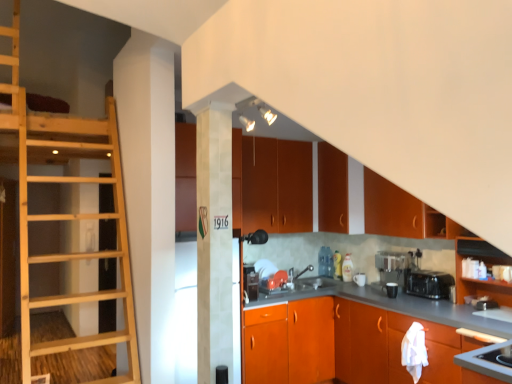
The width and height of the screenshot is (512, 384). Find the location of `matte wood cabinet at upper center, positioned as the 2th cabinetry in top-to-bottom order`. matte wood cabinet at upper center, positioned as the 2th cabinetry in top-to-bottom order is located at coordinates (339, 191).

You are a GUI agent. You are given a task and a screenshot of the screen. Output one action in this format:
    pyautogui.click(x=<x>, y=<y>)
    Task: Click on the metallic silver toaster at lower right, positioned as the first appliance in front-to-back order
    The image size is (512, 384).
    Given the screenshot: What is the action you would take?
    pyautogui.click(x=481, y=302)

You are a GUI agent. You are given a task and a screenshot of the screen. Output one action in this format:
    pyautogui.click(x=<x>, y=<y>)
    Task: Click on the matte wood cabinets at center, marked as the fourth cabinetry in a bottom-to-top arrangement
    This screenshot has width=512, height=384.
    Given the screenshot: What is the action you would take?
    pyautogui.click(x=277, y=186)

At what (x,y) coordinates should I click in order to perform the action: click on metallic silver coffee machine at lower right. Please return your answer as a coordinate pair (x, y). This screenshot has width=512, height=384. Looking at the image, I should click on (393, 267).

Image resolution: width=512 pixels, height=384 pixels. Identify the location of matte wood cabinet at upper center, positioned as the 2th cabinetry in top-to-bottom order. (339, 191).

Is orange matte cabinet at center, the 1th cabinetry ordered from the bottom, at the right side of natural wood ladder at left?

Yes, orange matte cabinet at center, the 1th cabinetry ordered from the bottom, is to the right of natural wood ladder at left.

From their relative heights in the image, would you say orange matte cabinet at center, the 6th cabinetry positioned from the top, is taller or shorter than natural wood ladder at left?

Clearly, orange matte cabinet at center, the 6th cabinetry positioned from the top, is shorter compared to natural wood ladder at left.

From the image's perspective, is orange matte cabinet at center, the 1th cabinetry ordered from the bottom, on top of natural wood ladder at left?

No, from the image's perspective, orange matte cabinet at center, the 1th cabinetry ordered from the bottom, is not over natural wood ladder at left.

Can you confirm if orange matte cabinet at center, the 6th cabinetry positioned from the top, is bigger than natural wood ladder at left?

Yes, orange matte cabinet at center, the 6th cabinetry positioned from the top, is bigger than natural wood ladder at left.

Is the depth of orange matte cabinet at center, the 1th cabinetry ordered from the bottom, less than that of orange matte cabinet at upper center, the 1th cabinetry when ordered from top to bottom?

That is True.

Locate an element on the screen. This screenshot has width=512, height=384. the 5th cabinetry above when counting from the orange matte cabinet at center, the 6th cabinetry positioned from the top (from the image's perspective) is located at coordinates (271, 184).

Is orange matte cabinet at center, the 6th cabinetry positioned from the top, positioned beyond the bounds of orange matte cabinet at upper center, the 6th cabinetry positioned from the bottom?

That's correct, orange matte cabinet at center, the 6th cabinetry positioned from the top, is outside of orange matte cabinet at upper center, the 6th cabinetry positioned from the bottom.

Is orange matte cabinet at center, the 1th cabinetry ordered from the bottom, thinner than matte black coffee maker at lower center, which is the fourth appliance in front-to-back order?

No, orange matte cabinet at center, the 1th cabinetry ordered from the bottom, is not thinner than matte black coffee maker at lower center, which is the fourth appliance in front-to-back order.

Considering the relative positions of orange matte cabinet at center, the 1th cabinetry ordered from the bottom, and matte black coffee maker at lower center, which is the fourth appliance in front-to-back order, in the image provided, is orange matte cabinet at center, the 1th cabinetry ordered from the bottom, to the left or to the right of matte black coffee maker at lower center, which is the fourth appliance in front-to-back order,?

orange matte cabinet at center, the 1th cabinetry ordered from the bottom, is to the left of matte black coffee maker at lower center, which is the fourth appliance in front-to-back order.

Can you confirm if orange matte cabinet at center, the 6th cabinetry positioned from the top, is shorter than matte black coffee maker at lower center, marked as the second appliance in a left-to-right arrangement?

Incorrect, the height of orange matte cabinet at center, the 6th cabinetry positioned from the top, does not fall short of that of matte black coffee maker at lower center, marked as the second appliance in a left-to-right arrangement.

From the image's perspective, is metallic silver toaster at lower right, which is the fourth appliance in left-to-right order, positioned above or below metallic silver toaster at center, which is the fourth appliance from right to left?

metallic silver toaster at lower right, which is the fourth appliance in left-to-right order, is situated lower than metallic silver toaster at center, which is the fourth appliance from right to left, in the image.

From the metallic silver toaster at center, the 1th appliance when ordered from left to right, count 2nd appliances forward and point to it. Please provide its 2D coordinates.

[(481, 302)]

How different are the orientations of metallic silver toaster at lower right, which is the 1th appliance in right-to-left order, and metallic silver toaster at center, the 1th appliance when ordered from left to right, in degrees?

They differ by 102 degrees in their facing directions.

Which object is more forward, metallic silver toaster at lower right, which is the 1th appliance in right-to-left order, or metallic silver toaster at center, the second appliance positioned from the back?

Positioned in front is metallic silver toaster at lower right, which is the 1th appliance in right-to-left order.

Which of these two, metallic silver toaster at lower right, positioned as the first appliance in front-to-back order, or black plastic toaster at lower right, arranged as the 3th appliance when viewed from the back, is smaller?

Smaller between the two is metallic silver toaster at lower right, positioned as the first appliance in front-to-back order.

Could you tell me if metallic silver toaster at lower right, positioned as the first appliance in front-to-back order, is turned towards black plastic toaster at lower right, which is the 3th appliance from left to right?

No.

Are metallic silver toaster at lower right, which is the 1th appliance in right-to-left order, and black plastic toaster at lower right, which is the 2th appliance in right-to-left order, located far from each other?

No, metallic silver toaster at lower right, which is the 1th appliance in right-to-left order, is not far away from black plastic toaster at lower right, which is the 2th appliance in right-to-left order.

Is point (479, 297) farther from viewer compared to point (447, 274)?

That is False.

Which of these two, matte wood cabinet at upper center, the 5th cabinetry ordered from the bottom, or orange matte cabinet at right, the second cabinetry from the bottom, is wider?

Wider between the two is matte wood cabinet at upper center, the 5th cabinetry ordered from the bottom.

Is matte wood cabinet at upper center, positioned as the 2th cabinetry in top-to-bottom order, beside orange matte cabinet at right, the second cabinetry from the bottom?

There is a gap between matte wood cabinet at upper center, positioned as the 2th cabinetry in top-to-bottom order, and orange matte cabinet at right, the second cabinetry from the bottom.

From a real-world perspective, which object rests below the other?

In real-world perspective, orange matte cabinet at right, the second cabinetry from the bottom, is lower.

Based on the photo, between matte wood cabinet at upper center, the 5th cabinetry ordered from the bottom, and orange matte cabinet at right, placed as the fifth cabinetry when sorted from top to bottom, which one has larger size?

matte wood cabinet at upper center, the 5th cabinetry ordered from the bottom, is bigger.

Does metallic silver toaster at lower right, which is the 4th appliance from back to front, have a lesser width compared to orange matte cabinet at center, the 6th cabinetry positioned from the top?

Correct, the width of metallic silver toaster at lower right, which is the 4th appliance from back to front, is less than that of orange matte cabinet at center, the 6th cabinetry positioned from the top.

Is point (466, 303) positioned in front of point (261, 347)?

Yes, point (466, 303) is closer to viewer.

Is metallic silver toaster at lower right, which is the 1th appliance in right-to-left order, outside of orange matte cabinet at center, the 6th cabinetry positioned from the top?

No, metallic silver toaster at lower right, which is the 1th appliance in right-to-left order, is not outside of orange matte cabinet at center, the 6th cabinetry positioned from the top.

Which of these two, metallic silver toaster at lower right, which is the fourth appliance in left-to-right order, or orange matte cabinet at center, the 1th cabinetry ordered from the bottom, stands taller?

Answer: With more height is orange matte cabinet at center, the 1th cabinetry ordered from the bottom.

Starting from the natural wood ladder at left, which cabinetry is the 4th one to the right? Please provide its 2D coordinates.

[(342, 344)]

The height and width of the screenshot is (384, 512). What are the coordinates of `the 5th cabinetry positioned above the orange matte cabinet at center, the 1th cabinetry ordered from the bottom (from the image's perspective)` in the screenshot? It's located at (271, 184).

Based on their spatial positions, is black plastic toaster at lower right, which is the 2th appliance in right-to-left order, or metallic silver toaster at center, which is the fourth appliance from right to left, further from matte wood cabinet at upper right, which ranks as the 3th cabinetry in bottom-to-top order?

metallic silver toaster at center, which is the fourth appliance from right to left.

From the image, which object appears to be farther from orange matte cabinet at upper center, the 1th cabinetry when ordered from top to bottom, black plastic toaster at lower right, which appears as the second appliance when viewed from the front, or matte wood cabinet at upper center, positioned as the 2th cabinetry in top-to-bottom order?

black plastic toaster at lower right, which appears as the second appliance when viewed from the front, lies further to orange matte cabinet at upper center, the 1th cabinetry when ordered from top to bottom, than the other object.

Which object lies further to the anchor point metallic silver toaster at lower right, which is the fourth appliance in left-to-right order, metallic silver toaster at center, the 1th appliance when ordered from left to right, or matte wood cabinets at center, marked as the fourth cabinetry in a bottom-to-top arrangement?

Among the two, matte wood cabinets at center, marked as the fourth cabinetry in a bottom-to-top arrangement, is located further to metallic silver toaster at lower right, which is the fourth appliance in left-to-right order.

In the scene shown: Looking at the image, which one is located closer to matte wood cabinet at upper right, which ranks as the 3th cabinetry in bottom-to-top order, metallic silver coffee machine at lower right or orange matte cabinet at upper center, the 6th cabinetry positioned from the bottom?

The object closer to matte wood cabinet at upper right, which ranks as the 3th cabinetry in bottom-to-top order, is orange matte cabinet at upper center, the 6th cabinetry positioned from the bottom.

From the image, which object appears to be farther from matte wood cabinets at center, which ranks as the third cabinetry in top-to-bottom order, metallic silver toaster at lower right, which is the 1th appliance in right-to-left order, or metallic silver toaster at center, which is the fourth appliance from right to left?

Based on the image, metallic silver toaster at lower right, which is the 1th appliance in right-to-left order, appears to be further to matte wood cabinets at center, which ranks as the third cabinetry in top-to-bottom order.

When comparing their distances from orange matte cabinet at center, the 6th cabinetry positioned from the top, does black plastic toaster at lower right, which is the 2th appliance in right-to-left order, or metallic silver coffee machine at lower right seem further?

Among the two, black plastic toaster at lower right, which is the 2th appliance in right-to-left order, is located further to orange matte cabinet at center, the 6th cabinetry positioned from the top.

Considering their positions, is metallic silver toaster at center, the second appliance positioned from the back, positioned further to orange matte cabinet at center, the 6th cabinetry positioned from the top, than metallic silver toaster at lower right, which is the fourth appliance in left-to-right order?

metallic silver toaster at lower right, which is the fourth appliance in left-to-right order, is positioned further to the anchor orange matte cabinet at center, the 6th cabinetry positioned from the top.

From the image, which object appears to be farther from orange matte cabinet at right, placed as the fifth cabinetry when sorted from top to bottom, matte wood cabinet at upper center, positioned as the 2th cabinetry in top-to-bottom order, or matte black coffee maker at lower center, positioned as the first appliance in back-to-front order?

Among the two, matte wood cabinet at upper center, positioned as the 2th cabinetry in top-to-bottom order, is located further to orange matte cabinet at right, placed as the fifth cabinetry when sorted from top to bottom.

At what (x,y) coordinates should I click in order to perform the action: click on coffee machine located between orange matte cabinet at upper center, the 6th cabinetry positioned from the bottom, and matte wood cabinet at upper center, the 5th cabinetry ordered from the bottom, in the depth direction. Please return your answer as a coordinate pair (x, y). Looking at the image, I should click on (393, 267).

Where is `appliance between orange matte cabinet at center, the 6th cabinetry positioned from the top, and black plastic toaster at lower right, arranged as the 3th appliance when viewed from the back, in the front-back direction`? The width and height of the screenshot is (512, 384). appliance between orange matte cabinet at center, the 6th cabinetry positioned from the top, and black plastic toaster at lower right, arranged as the 3th appliance when viewed from the back, in the front-back direction is located at coordinates click(x=481, y=302).

This screenshot has height=384, width=512. Find the location of `coffee machine situated between matte black coffee maker at lower center, which is the fourth appliance in front-to-back order, and black plastic toaster at lower right, which is the 3th appliance from left to right, from left to right`. coffee machine situated between matte black coffee maker at lower center, which is the fourth appliance in front-to-back order, and black plastic toaster at lower right, which is the 3th appliance from left to right, from left to right is located at coordinates [x=393, y=267].

Where is `coffee machine between orange matte cabinet at upper center, the 1th cabinetry when ordered from top to bottom, and black plastic toaster at lower right, which is the 2th appliance in right-to-left order, from left to right`? This screenshot has width=512, height=384. coffee machine between orange matte cabinet at upper center, the 1th cabinetry when ordered from top to bottom, and black plastic toaster at lower right, which is the 2th appliance in right-to-left order, from left to right is located at coordinates (393, 267).